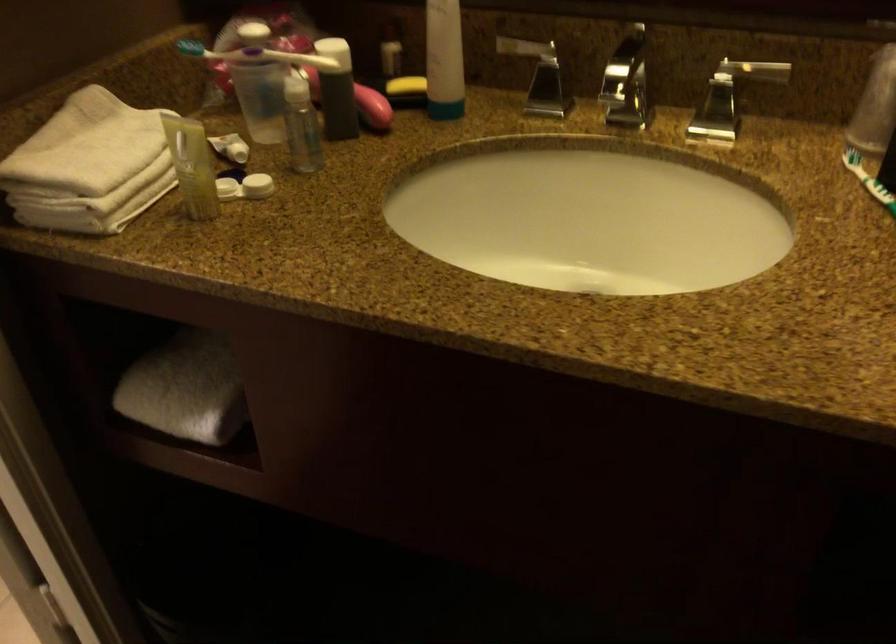
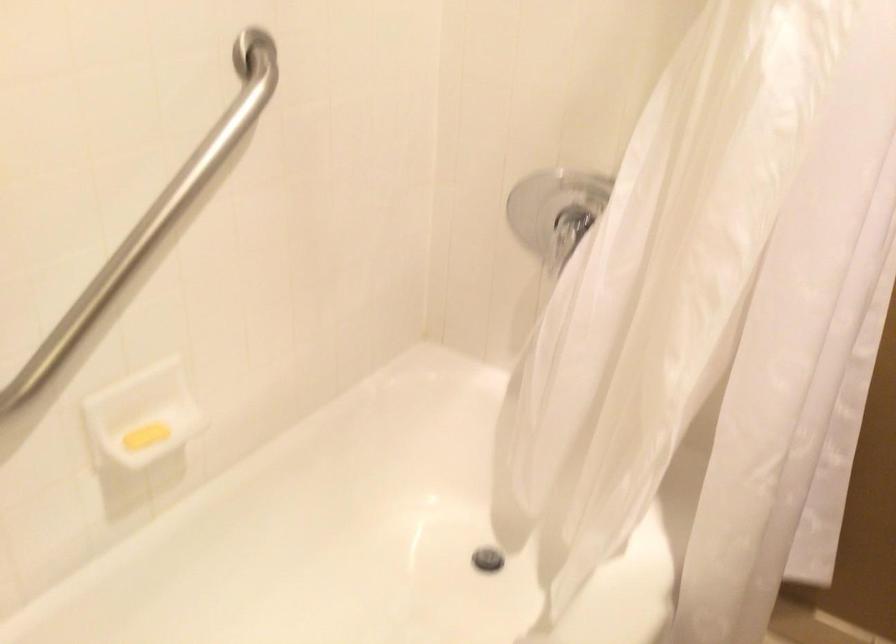
Based on the continuous images, in which direction is the camera rotating?

The rotation direction of the camera is left-down.